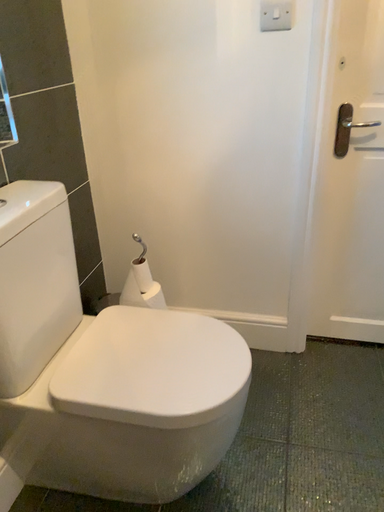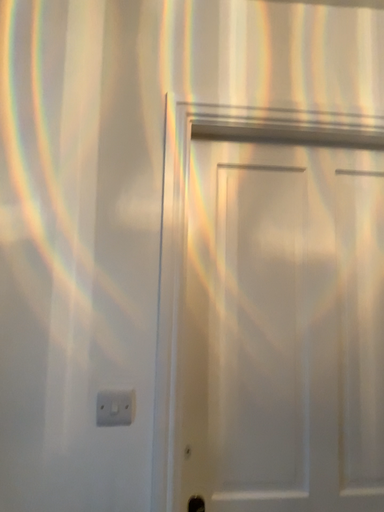
Question: How did the camera likely rotate when shooting the video?

Choices:
 (A) rotated downward
 (B) rotated upward

Answer: (B)